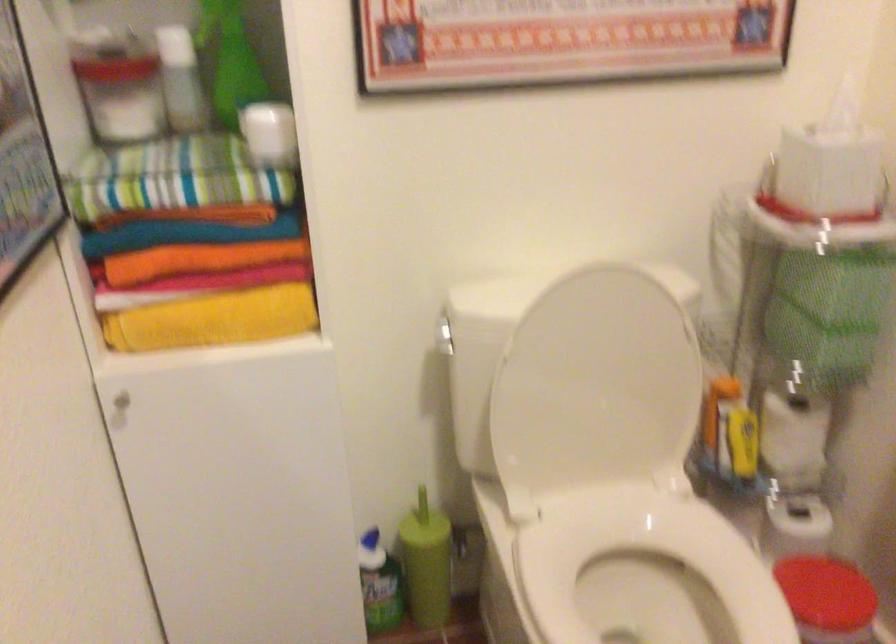
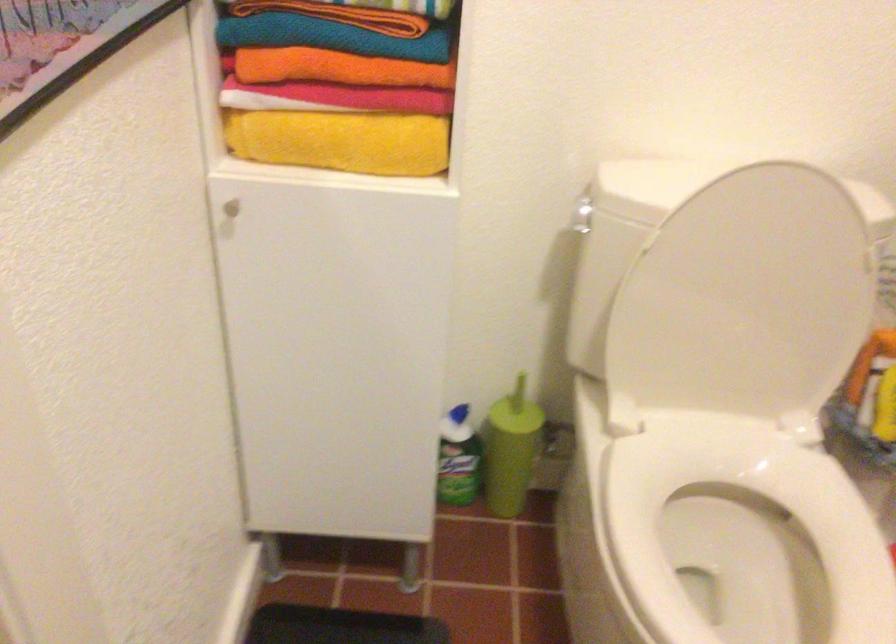
Where in the second image is the point corresponding to the point at 216,321 from the first image?

(341, 140)